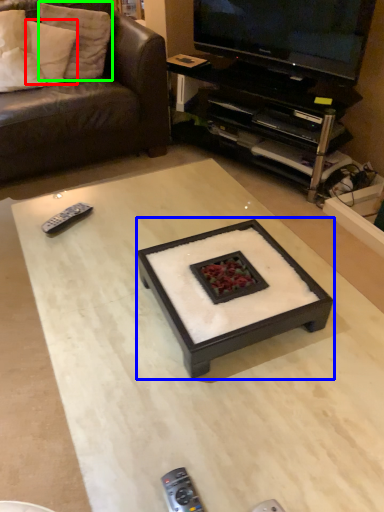
Question: Based on their relative distances, which object is nearer to pillow (highlighted by a red box)? Choose from coffee table (highlighted by a blue box) and pillow (highlighted by a green box).

Choices:
 (A) coffee table
 (B) pillow

Answer: (B)